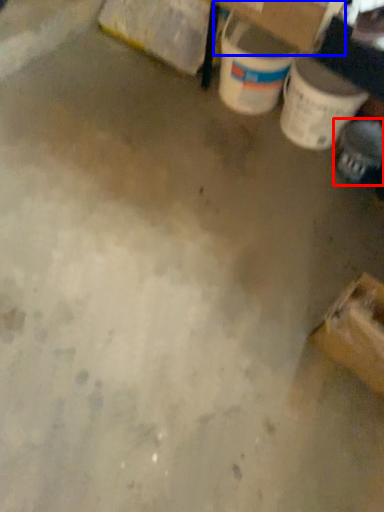
Question: Which point is further to the camera, footwear (highlighted by a red box) or cardboard box (highlighted by a blue box)?

Choices:
 (A) footwear
 (B) cardboard box

Answer: (A)